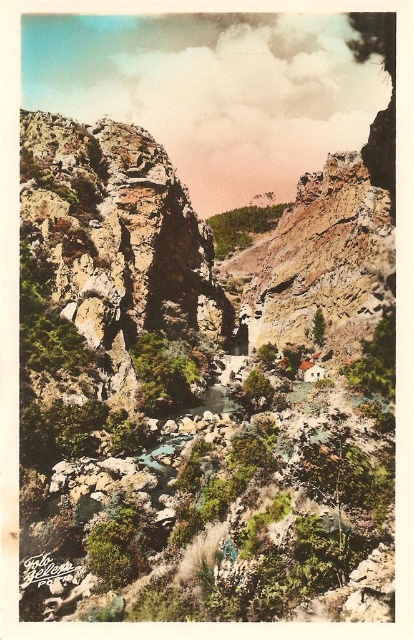
You are standing at the edge of the canyon and see the green leafy shrubs at center and the green leafy trees at center. Which one is closer to you?

The green leafy shrubs at center are closer to you because they are positioned in front of the green leafy trees at center.